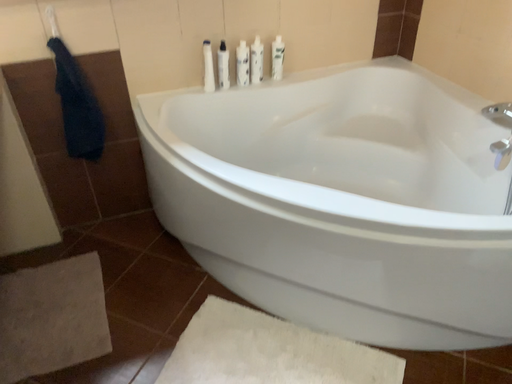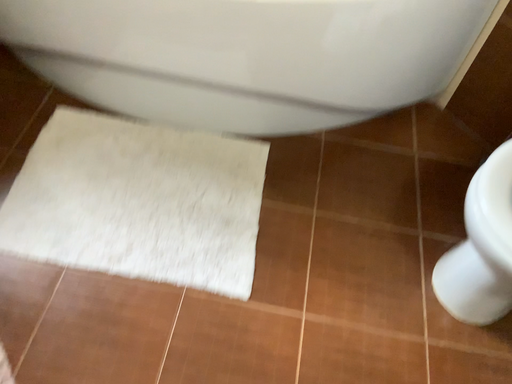
Question: How did the camera likely rotate when shooting the video?

Choices:
 (A) rotated left
 (B) rotated right

Answer: (B)